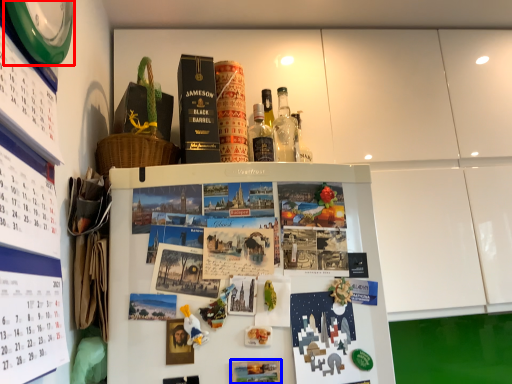
Question: Which point is further to the camera, clock (highlighted by a red box) or book cover (highlighted by a blue box)?

Choices:
 (A) clock
 (B) book cover

Answer: (B)